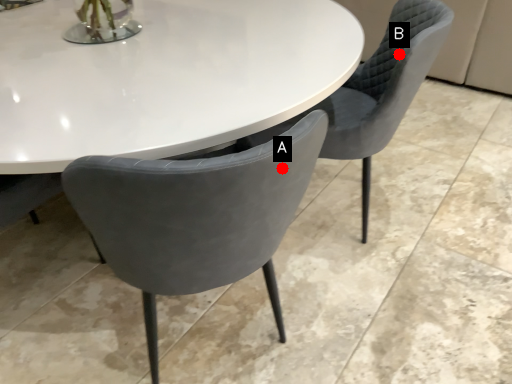
Question: Two points are circled on the image, labeled by A and B beside each circle. Which point is further to the camera?

Choices:
 (A) A is further
 (B) B is further

Answer: (B)